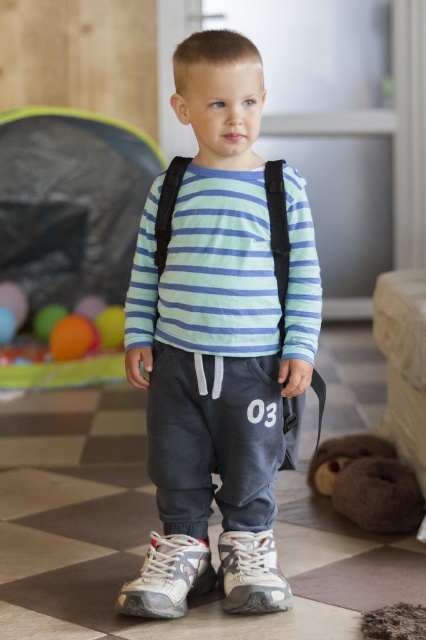
How distant is striped cotton shirt at center from white mesh shoe at lower center?

striped cotton shirt at center is 29.09 inches from white mesh shoe at lower center.

Which of these two, striped cotton shirt at center or white mesh shoe at lower center, stands shorter?

white mesh shoe at lower center is shorter.

You are a GUI agent. You are given a task and a screenshot of the screen. Output one action in this format:
    pyautogui.click(x=<x>, y=<y>)
    Task: Click on the striped cotton shirt at center
    Image resolution: width=426 pixels, height=640 pixels.
    Given the screenshot: What is the action you would take?
    click(207, 269)

Does matte gray sweatpants at center appear on the left side of matte orange ball at lower left?

No, matte gray sweatpants at center is not to the left of matte orange ball at lower left.

In the scene shown: Measure the distance between point [255,467] and camera.

6.40 feet

Is point (221, 360) positioned after point (123, 316)?

No, it is in front of (123, 316).

The image size is (426, 640). In order to click on matte gray sweatpants at center in this screenshot , I will do `click(218, 340)`.

Is point (176, 328) closer to viewer compared to point (374, 513)?

That is True.

Is striped cotton shirt at center thinner than brown plush toy at lower right?

No, striped cotton shirt at center is not thinner than brown plush toy at lower right.

Which is behind, point (137, 342) or point (348, 435)?

The point (348, 435) is more distant.

Identify the location of striped cotton shirt at center. The image size is (426, 640). (207, 269).